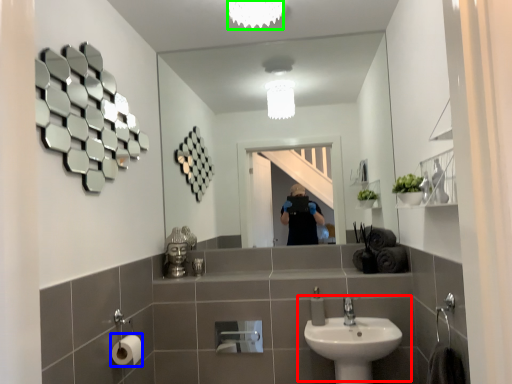
Question: Which is farther away from sink (highlighted by a red box)? toilet paper (highlighted by a blue box) or light fixture (highlighted by a green box)?

Choices:
 (A) toilet paper
 (B) light fixture

Answer: (B)